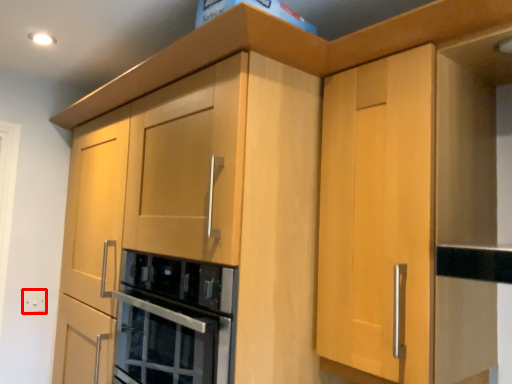
Question: From the image's perspective, where is electric outlet (annotated by the red box) located in relation to home appliance in the image?

Choices:
 (A) below
 (B) above

Answer: (A)